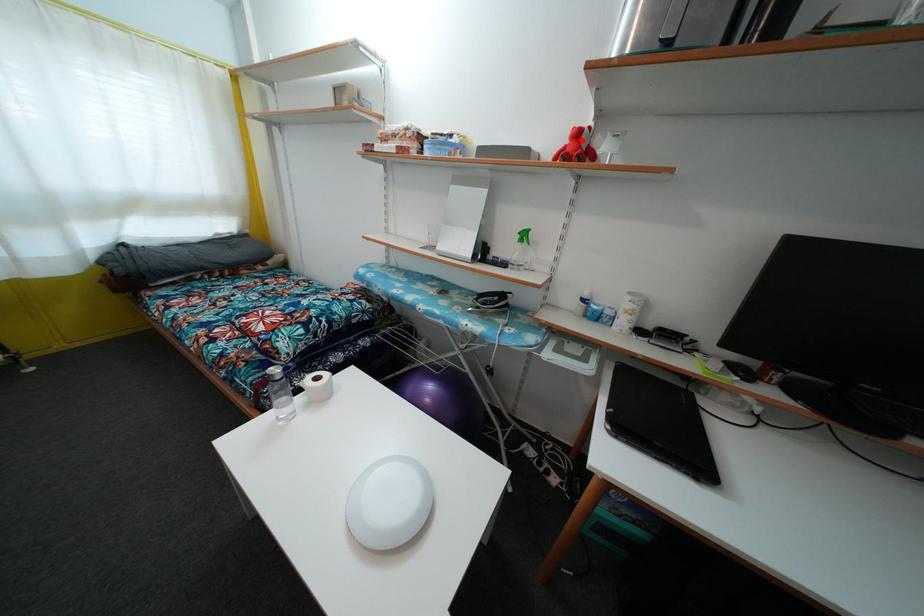
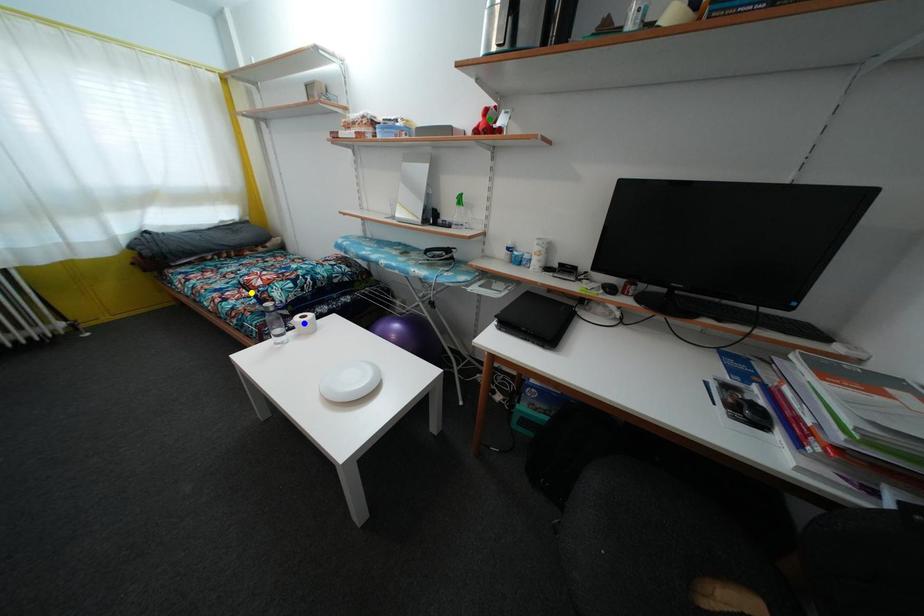
Question: I am providing you with two images of the same scene from different viewpoints. A red point is marked on the first image. You are given multiple points on the second image. Which point in image 2 represents the same 3d spot as the red point in image 1?

Choices:
 (A) green point
 (B) blue point
 (C) yellow point

Answer: (A)